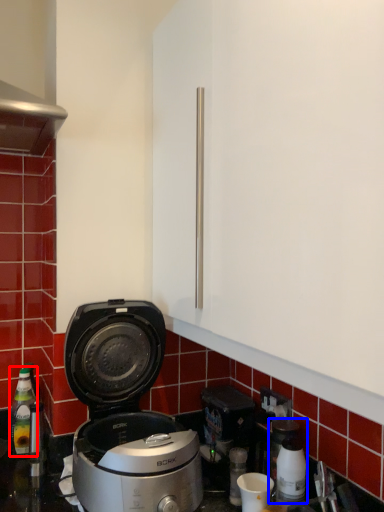
Question: Which point is closer to the camera, bottle (highlighted by a red box) or coffee machine (highlighted by a blue box)?

Choices:
 (A) bottle
 (B) coffee machine

Answer: (B)